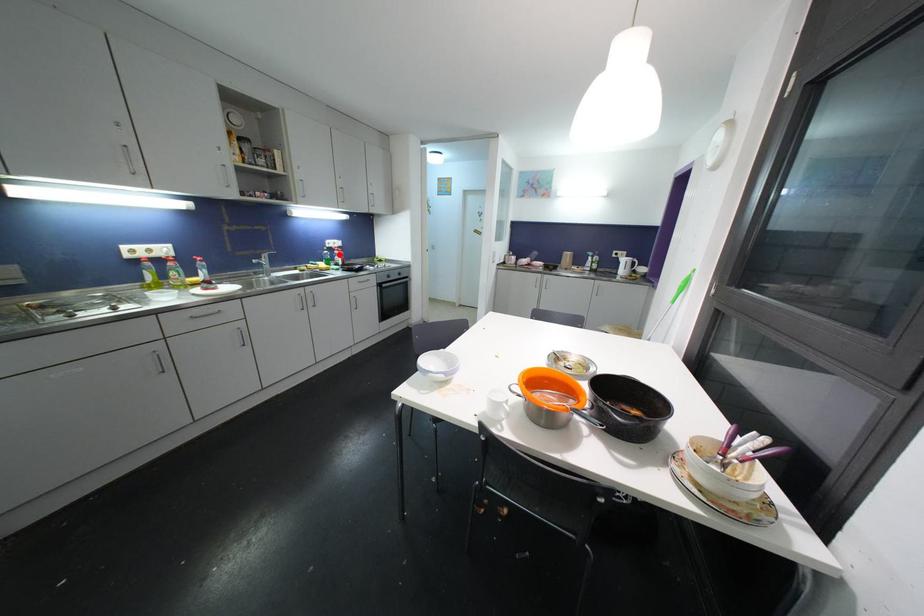
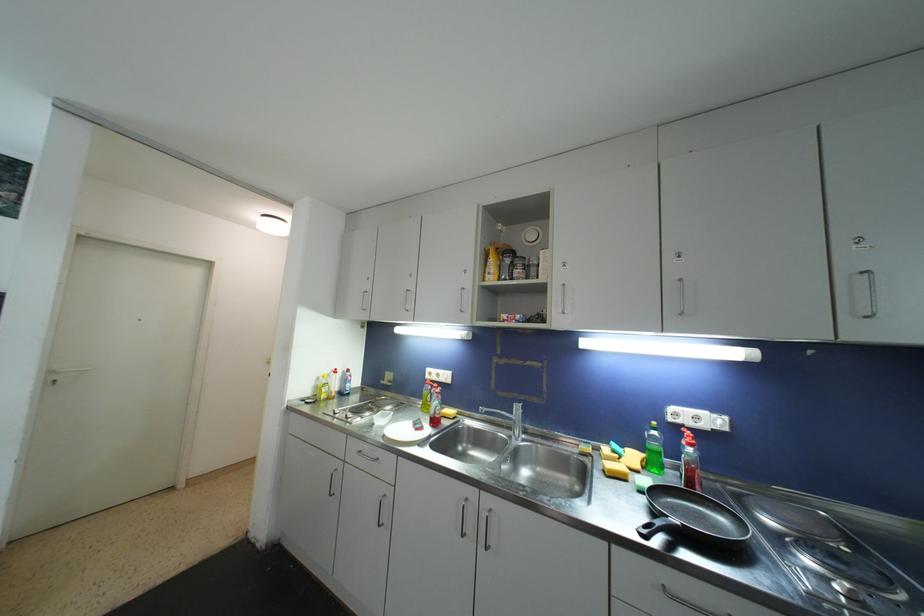
Question: I am providing you with two images of the same scene from different viewpoints. Image1 has a red point marked. In image2, the corresponding 3D location appears at what relative position? Reply with the corresponding letter.

Choices:
 (A) Closer
 (B) Farther

Answer: (B)